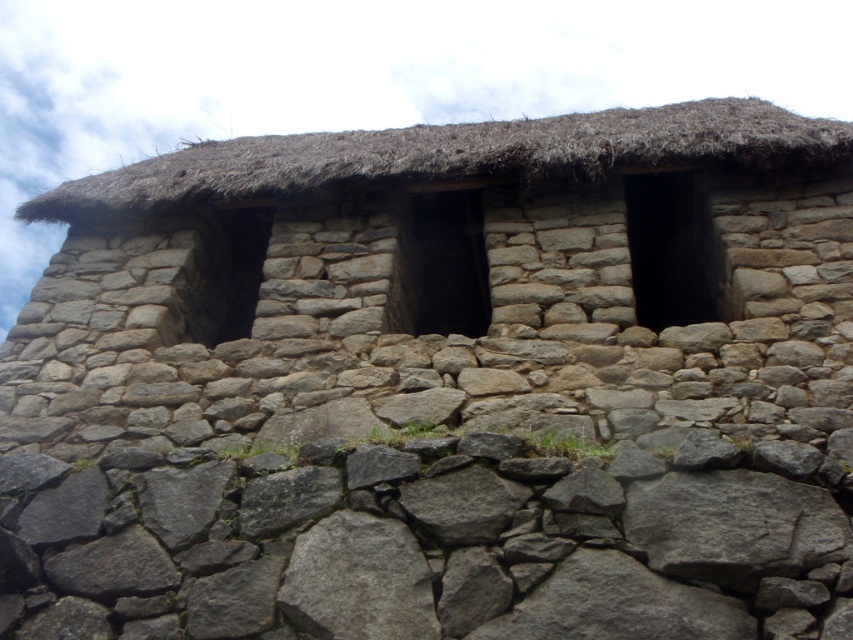
You are an architect examining the traditional stone structure. You notice the natural stone hut at center and the gray rough stone at lower center. Which object has a greater width according to the description?

The natural stone hut at center has a greater width than the gray rough stone at lower center.

You are an architect examining the stone structure. You need to determine the spatial relationship between the gray rough stone at lower center and the brown thatch at upper center. Which object is positioned to the left of the other?

The gray rough stone at lower center is to the left of brown thatch at upper center.